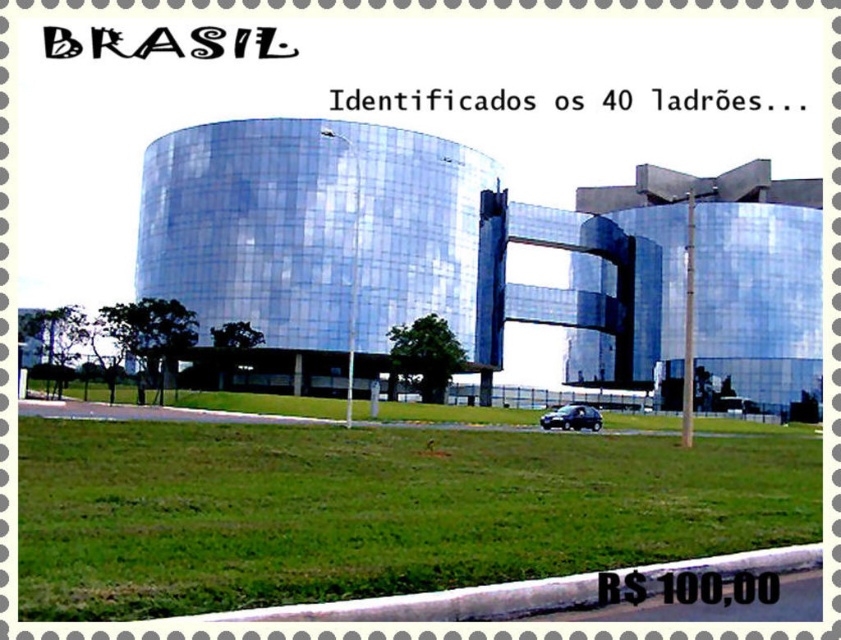
Does green grass at lower center appear under shiny black car at lower center?

Incorrect, green grass at lower center is not positioned below shiny black car at lower center.

Describe the element at coordinates (374, 509) in the screenshot. I see `green grass at lower center` at that location.

This screenshot has height=640, width=841. I want to click on green grass at lower center, so click(x=374, y=509).